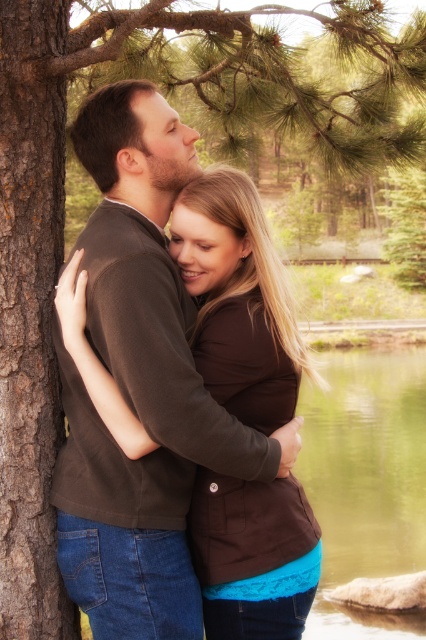
You are an artist planning to paint this scene. You want to ensure the brown matte sweater at center is proportionally accurate compared to the green liquid water at lower center. Based on the scene, which object should you make larger in your painting?

The green liquid water at lower center should be painted larger than the brown matte sweater at center since it is stated that the brown matte sweater at center is smaller than the green liquid water at lower center.

You are standing in the scene and want to place a small gift exactly at the point marked by the coordinates point (138, 384). Which object in the scene is located at that exact point?

The brown matte sweater at center is located at point (138, 384).

You are a photographer adjusting your camera settings to capture the scene. You notice the brown matte sweater at center and the green liquid water at lower center in your viewfinder. Which object appears shorter in the frame?

The brown matte sweater at center appears shorter than the green liquid water at lower center in the frame.